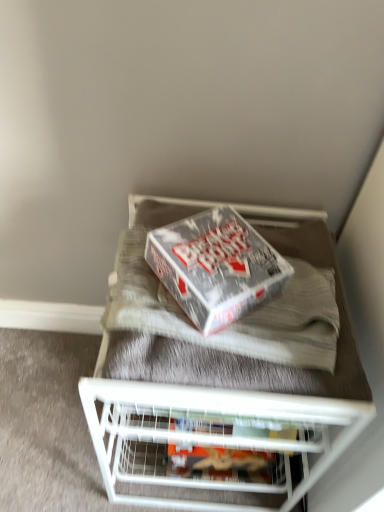
Question: From the image's perspective, is white metal shelf at upper center above white wire shelf at center?

Choices:
 (A) no
 (B) yes

Answer: (B)

Question: Is white metal shelf at upper center facing away from white wire shelf at center?

Choices:
 (A) yes
 (B) no

Answer: (B)

Question: Is white metal shelf at upper center positioned beyond the bounds of white wire shelf at center?

Choices:
 (A) yes
 (B) no

Answer: (A)

Question: Is white metal shelf at upper center thinner than white wire shelf at center?

Choices:
 (A) yes
 (B) no

Answer: (A)

Question: Would you say white wire shelf at center is part of white metal shelf at upper center's contents?

Choices:
 (A) no
 (B) yes

Answer: (A)

Question: From a real-world perspective, is white metal shelf at upper center positioned above or below silver metallic box at center?

Choices:
 (A) below
 (B) above

Answer: (A)

Question: In terms of height, does white metal shelf at upper center look taller or shorter compared to silver metallic box at center?

Choices:
 (A) tall
 (B) short

Answer: (A)

Question: Is white metal shelf at upper center in front of or behind silver metallic box at center in the image?

Choices:
 (A) front
 (B) behind

Answer: (B)

Question: Looking at the image, does white metal shelf at upper center seem bigger or smaller compared to silver metallic box at center?

Choices:
 (A) big
 (B) small

Answer: (A)

Question: Considering the relative positions of matte cardboard box at center and white wire shelf at center in the image provided, is matte cardboard box at center to the left or to the right of white wire shelf at center?

Choices:
 (A) left
 (B) right

Answer: (B)

Question: From the image's perspective, is matte cardboard box at center positioned above or below white wire shelf at center?

Choices:
 (A) below
 (B) above

Answer: (B)

Question: From their relative heights in the image, would you say matte cardboard box at center is taller or shorter than white wire shelf at center?

Choices:
 (A) tall
 (B) short

Answer: (A)

Question: Looking at their shapes, would you say matte cardboard box at center is wider or thinner than white wire shelf at center?

Choices:
 (A) wide
 (B) thin

Answer: (B)

Question: In the image, is silver metallic box at center positioned in front of or behind white wire shelf at center?

Choices:
 (A) behind
 (B) front

Answer: (B)

Question: In terms of width, does silver metallic box at center look wider or thinner when compared to white wire shelf at center?

Choices:
 (A) wide
 (B) thin

Answer: (B)